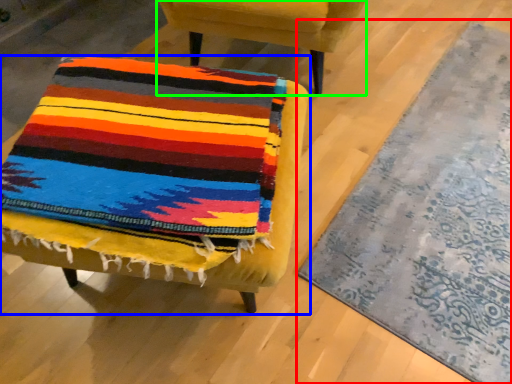
Question: Estimate the real-world distances between objects in this image. Which object is closer to mat (highlighted by a red box), chair (highlighted by a blue box) or chair (highlighted by a green box)?

Choices:
 (A) chair
 (B) chair

Answer: (A)